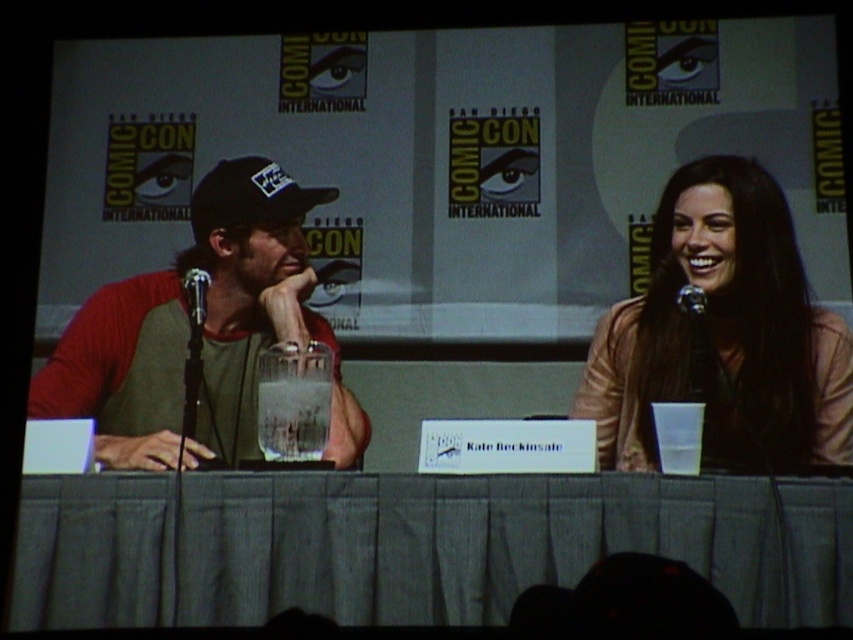
Question: Estimate the real-world distances between objects in this image. Which object is farther from the gray fabric table at center?

Choices:
 (A) matte pink sweater at right
 (B) metallic silver microphone at upper right
 (C) metallic silver microphone at center

Answer: (B)

Question: Estimate the real-world distances between objects in this image. Which object is closer to the black matte baseball cap at left?

Choices:
 (A) matte green t-shirt at left
 (B) metallic silver microphone at center
 (C) matte pink sweater at right
 (D) metallic silver microphone at upper right

Answer: (A)

Question: Is black matte baseball cap at left smaller than metallic silver microphone at center?

Choices:
 (A) no
 (B) yes

Answer: (A)

Question: Is metallic silver microphone at center bigger than metallic silver microphone at upper right?

Choices:
 (A) no
 (B) yes

Answer: (B)

Question: Which point is closer to the camera?

Choices:
 (A) (206, 291)
 (B) (779, 216)
 (C) (270, 300)
 (D) (691, 316)

Answer: (D)

Question: Can you confirm if matte green t-shirt at left is positioned below black matte baseball cap at left?

Choices:
 (A) yes
 (B) no

Answer: (A)